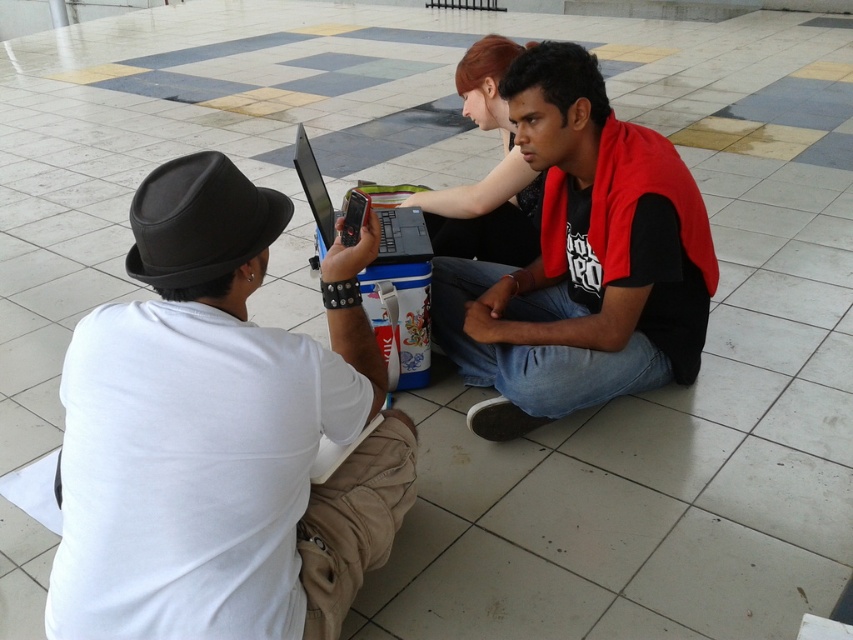
Question: Does white matte shirt at left appear on the left side of black matte plug hat at left?

Choices:
 (A) no
 (B) yes

Answer: (A)

Question: Can you confirm if white matte shirt at left is positioned to the left of silver metallic laptop at center?

Choices:
 (A) yes
 (B) no

Answer: (A)

Question: Is white matte shirt at left thinner than black matte plug hat at left?

Choices:
 (A) yes
 (B) no

Answer: (B)

Question: Which is nearer to the silver metallic laptop at center?

Choices:
 (A) white matte shirt at left
 (B) black matte plug hat at left
 (C) black matte shirt at center

Answer: (C)

Question: Considering the real-world distances, which object is closest to the black matte plug hat at left?

Choices:
 (A) white matte shirt at left
 (B) silver metallic laptop at center

Answer: (A)

Question: Which of the following is the closest to the observer?

Choices:
 (A) black matte shirt at center
 (B) white matte shirt at left

Answer: (B)